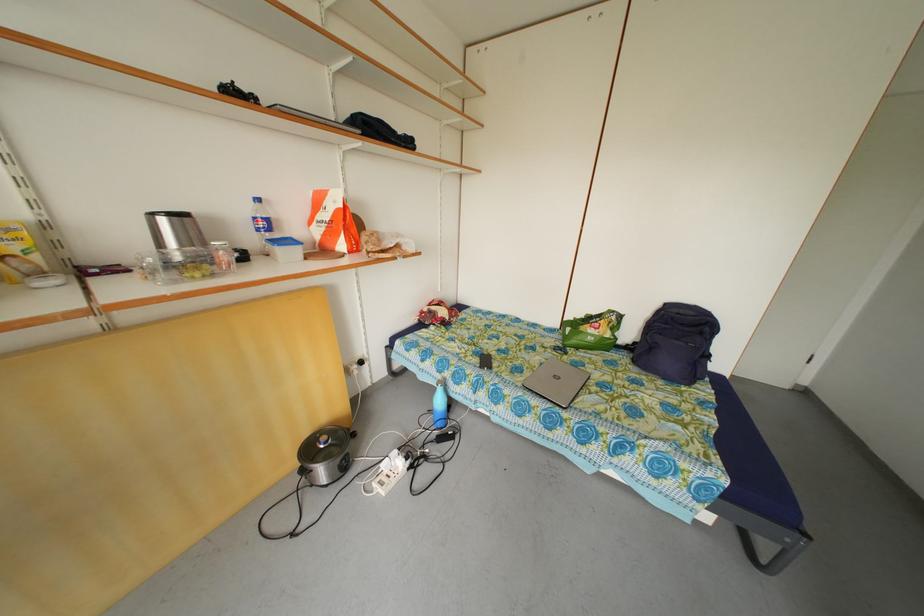
Find where to lift the blue backpack. Please return your answer as a coordinate pair (x, y).

(676, 342)